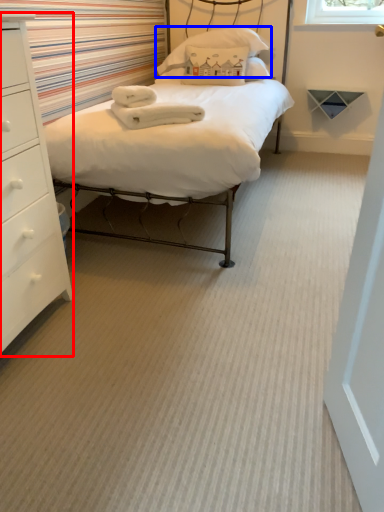
Question: Which of the following is the closest to the observer, chest of drawers (highlighted by a red box) or pillow (highlighted by a blue box)?

Choices:
 (A) chest of drawers
 (B) pillow

Answer: (A)